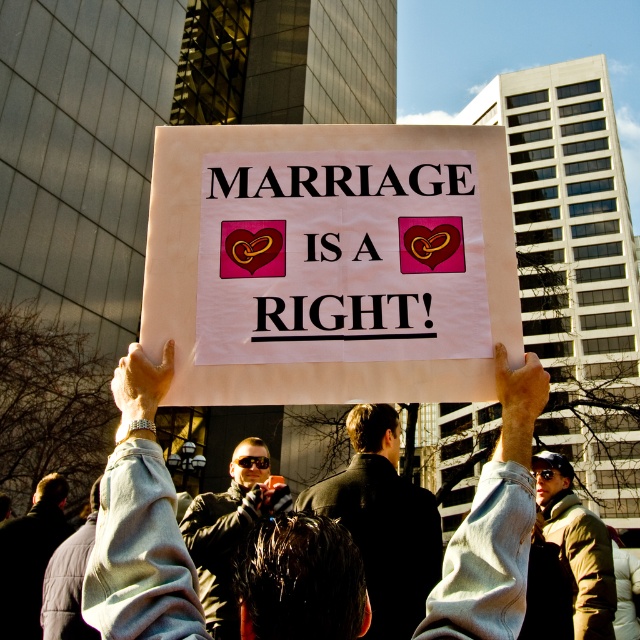
Can you confirm if white paper sign at center is positioned to the left of light gray sweatshirt at center?

In fact, white paper sign at center is to the right of light gray sweatshirt at center.

Describe the element at coordinates (328, 262) in the screenshot. I see `white paper sign at center` at that location.

Between point (260, 145) and point (506, 513), which one is positioned behind?

Point (260, 145)

Where is `white paper sign at center`? The width and height of the screenshot is (640, 640). white paper sign at center is located at coordinates (328, 262).